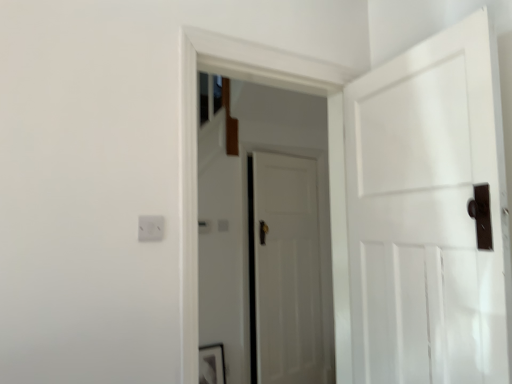
This screenshot has width=512, height=384. What do you see at coordinates (291, 270) in the screenshot? I see `white matte door at center, which is the first door from back to front` at bounding box center [291, 270].

The image size is (512, 384). In order to click on white matte door at center, which is the first door from back to front in this screenshot , I will do `click(291, 270)`.

Identify the location of white matte door at center, the 1th door from the front. (426, 213).

Which of these two, white matte door at center, marked as the 2th door in a back-to-front arrangement, or white matte door at center, positioned as the 2th door in front-to-back order, is wider?

white matte door at center, positioned as the 2th door in front-to-back order.

Is white matte door at center, marked as the 2th door in a back-to-front arrangement, aimed at white matte door at center, positioned as the 2th door in front-to-back order?

No, white matte door at center, marked as the 2th door in a back-to-front arrangement, is not aimed at white matte door at center, positioned as the 2th door in front-to-back order.

Is the position of white matte door at center, the 1th door from the front, more distant than that of white matte door at center, positioned as the 2th door in front-to-back order?

That is False.

From the picture: From the image's perspective, which one is positioned lower, white matte door at center, the 1th door from the front, or white matte door at center, which is the first door from back to front?

white matte door at center, which is the first door from back to front, appears lower in the image.

Does white matte door at center, positioned as the 2th door in front-to-back order, have a larger size compared to white matte door at center, marked as the 2th door in a back-to-front arrangement?

Incorrect, white matte door at center, positioned as the 2th door in front-to-back order, is not larger than white matte door at center, marked as the 2th door in a back-to-front arrangement.

From the image's perspective, is white matte door at center, positioned as the 2th door in front-to-back order, located above white matte door at center, marked as the 2th door in a back-to-front arrangement?

No, from the image's perspective, white matte door at center, positioned as the 2th door in front-to-back order, is not over white matte door at center, marked as the 2th door in a back-to-front arrangement.

From a real-world perspective, who is located lower, white matte door at center, which is the first door from back to front, or white matte door at center, the 1th door from the front?

white matte door at center, which is the first door from back to front, from a real-world perspective.

Which object is closer to the camera taking this photo, white matte door at center, which is the first door from back to front, or white matte door at center, marked as the 2th door in a back-to-front arrangement?

white matte door at center, marked as the 2th door in a back-to-front arrangement, is more forward.

Considering the sizes of objects matte black picture frame at lower center and white matte door at center, marked as the 2th door in a back-to-front arrangement, in the image provided, who is smaller, matte black picture frame at lower center or white matte door at center, marked as the 2th door in a back-to-front arrangement,?

Smaller between the two is matte black picture frame at lower center.

How much distance is there between matte black picture frame at lower center and white matte door at center, marked as the 2th door in a back-to-front arrangement?

matte black picture frame at lower center and white matte door at center, marked as the 2th door in a back-to-front arrangement, are 1.89 meters apart from each other.

Is white matte door at center, marked as the 2th door in a back-to-front arrangement, surrounded by matte black picture frame at lower center?

Actually, white matte door at center, marked as the 2th door in a back-to-front arrangement, is outside matte black picture frame at lower center.

Find the location of a particular element. picture frame that appears behind the white matte door at center, the 1th door from the front is located at coordinates (211, 364).

Based on the photo, is white matte door at center, positioned as the 2th door in front-to-back order, aimed at matte black picture frame at lower center?

No, white matte door at center, positioned as the 2th door in front-to-back order, is not facing towards matte black picture frame at lower center.

Between point (314, 278) and point (207, 377), which one is positioned in front?

The point (207, 377) is closer to the camera.

You are a GUI agent. You are given a task and a screenshot of the screen. Output one action in this format:
    pyautogui.click(x=<x>, y=<y>)
    Task: Click on the 1st door to the right when counting from the matte black picture frame at lower center
    Image resolution: width=512 pixels, height=384 pixels.
    Given the screenshot: What is the action you would take?
    pyautogui.click(x=291, y=270)

How many degrees apart are the facing directions of white matte door at center, positioned as the 2th door in front-to-back order, and matte black picture frame at lower center?

8.46 degrees.

Is matte black picture frame at lower center touching white matte door at center, positioned as the 2th door in front-to-back order?

They are not placed beside each other.

Consider the image. Is matte black picture frame at lower center oriented towards white matte door at center, positioned as the 2th door in front-to-back order?

No, matte black picture frame at lower center does not turn towards white matte door at center, positioned as the 2th door in front-to-back order.

You are a GUI agent. You are given a task and a screenshot of the screen. Output one action in this format:
    pyautogui.click(x=<x>, y=<y>)
    Task: Click on the picture frame on the left of the white matte door at center, which is the first door from back to front
    
    Given the screenshot: What is the action you would take?
    pyautogui.click(x=211, y=364)

Consider the image. Is white matte door at center, the 1th door from the front, turned away from matte black picture frame at lower center?

No, white matte door at center, the 1th door from the front,'s orientation is not away from matte black picture frame at lower center.

Is white matte door at center, the 1th door from the front, touching matte black picture frame at lower center?

They are not placed beside each other.

From a real-world perspective, is white matte door at center, marked as the 2th door in a back-to-front arrangement, below matte black picture frame at lower center?

Incorrect, from a real-world perspective, white matte door at center, marked as the 2th door in a back-to-front arrangement, is higher than matte black picture frame at lower center.

I want to click on door below the white matte door at center, marked as the 2th door in a back-to-front arrangement (from the image's perspective), so click(x=291, y=270).

The height and width of the screenshot is (384, 512). In order to click on door to the right of white matte door at center, which is the first door from back to front in this screenshot , I will do `click(426, 213)`.

Considering their positions, is matte black picture frame at lower center positioned further to white matte door at center, marked as the 2th door in a back-to-front arrangement, than white matte door at center, positioned as the 2th door in front-to-back order?

matte black picture frame at lower center is further to white matte door at center, marked as the 2th door in a back-to-front arrangement.

When comparing their distances from white matte door at center, the 1th door from the front, does white matte door at center, which is the first door from back to front, or matte black picture frame at lower center seem further?

matte black picture frame at lower center is positioned further to the anchor white matte door at center, the 1th door from the front.

Based on their spatial positions, is matte black picture frame at lower center or white matte door at center, the 1th door from the front, further from white matte door at center, which is the first door from back to front?

Based on the image, white matte door at center, the 1th door from the front, appears to be further to white matte door at center, which is the first door from back to front.

Based on their spatial positions, is white matte door at center, the 1th door from the front, or matte black picture frame at lower center closer to white matte door at center, positioned as the 2th door in front-to-back order?

matte black picture frame at lower center.

When comparing their distances from matte black picture frame at lower center, does white matte door at center, the 1th door from the front, or white matte door at center, which is the first door from back to front, seem closer?

white matte door at center, which is the first door from back to front, is closer to matte black picture frame at lower center.

From the image, which object appears to be nearer to matte black picture frame at lower center, white matte door at center, positioned as the 2th door in front-to-back order, or white matte door at center, marked as the 2th door in a back-to-front arrangement?

Among the two, white matte door at center, positioned as the 2th door in front-to-back order, is located nearer to matte black picture frame at lower center.

Locate an element on the screen. Image resolution: width=512 pixels, height=384 pixels. picture frame located between white matte door at center, marked as the 2th door in a back-to-front arrangement, and white matte door at center, which is the first door from back to front, in the depth direction is located at coordinates (211, 364).